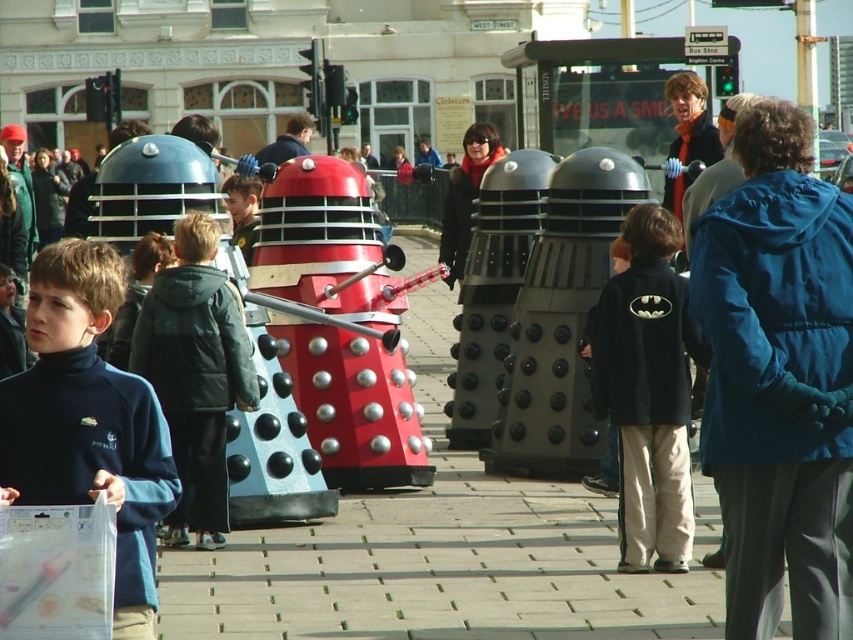
Looking at this image, you are standing in the square and want to take a photo of both the red Dalek and the blue Dalek. The red Dalek is at point (140,579) and the blue Dalek is at point (219,340). Which Dalek should you focus on first to ensure both are in the frame?

You should focus on the red Dalek at point (140,579) first because it is closer to you than the blue Dalek at point (219,340), ensuring both will be in the frame when properly composed.

You are organizing a charity event and need to place two jackets on a narrow display table. The navy blue fleece jacket at center and the green fuzzy jacket at center are available. Given their sizes, which jacket should you choose to ensure it fits comfortably on the table?

The navy blue fleece jacket at center has a smaller width than the green fuzzy jacket at center, so it would fit better on the narrow display table.

You are a photographer standing in the public square and see both the navy blue fleece jacket at center and the green fuzzy jacket at center. Which jacket is closer to the ground?

The navy blue fleece jacket at center is closer to the ground because it is positioned under the green fuzzy jacket at center.